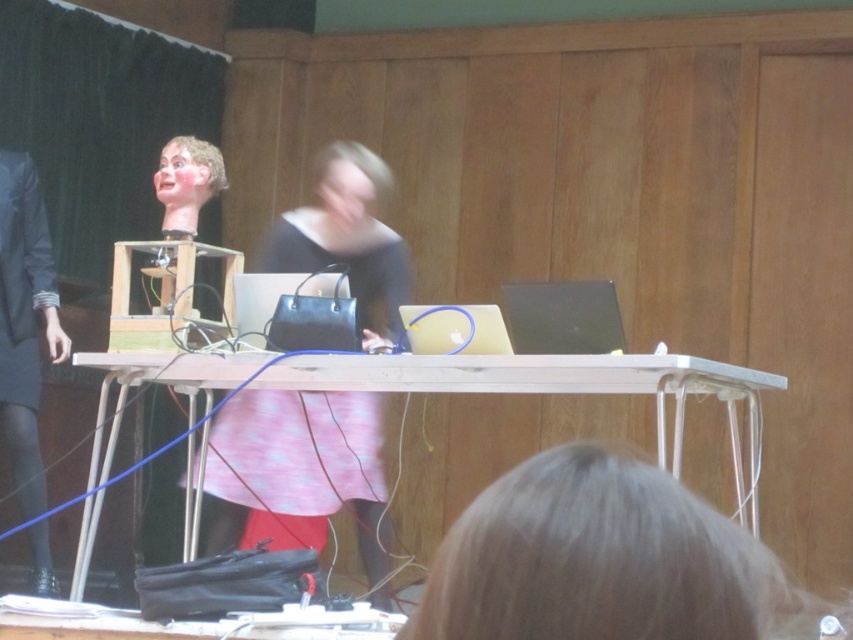
Between point (360, 452) and point (93, 508), which one is positioned in front?

Point (93, 508)

Can you confirm if pink fabric skirt at center is positioned to the right of wooden table at center?

No, pink fabric skirt at center is not to the right of wooden table at center.

Where is `pink fabric skirt at center`? This screenshot has width=853, height=640. pink fabric skirt at center is located at coordinates (299, 474).

Between wooden table at center and dark gray fabric business suit at left, which one is positioned lower?

wooden table at center is lower down.

Does wooden table at center appear on the right side of dark gray fabric business suit at left?

Yes, wooden table at center is to the right of dark gray fabric business suit at left.

Is point (657, 454) in front of point (0, 332)?

Yes, point (657, 454) is in front of point (0, 332).

Locate an element on the screen. wooden table at center is located at coordinates (544, 381).

Which of these two, pink fabric skirt at center or dark gray fabric business suit at left, stands shorter?

pink fabric skirt at center

Which of these two, pink fabric skirt at center or dark gray fabric business suit at left, stands taller?

Standing taller between the two is dark gray fabric business suit at left.

This screenshot has width=853, height=640. What do you see at coordinates (299, 474) in the screenshot? I see `pink fabric skirt at center` at bounding box center [299, 474].

The height and width of the screenshot is (640, 853). I want to click on pink fabric skirt at center, so click(x=299, y=474).